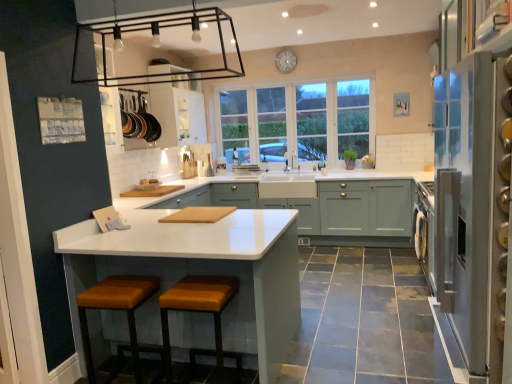
Locate an element on the screen. This screenshot has height=384, width=512. free spot above orange fabric stool at lower center, placed as the second step stool when sorted from left to right (from a real-world perspective) is located at coordinates (199, 289).